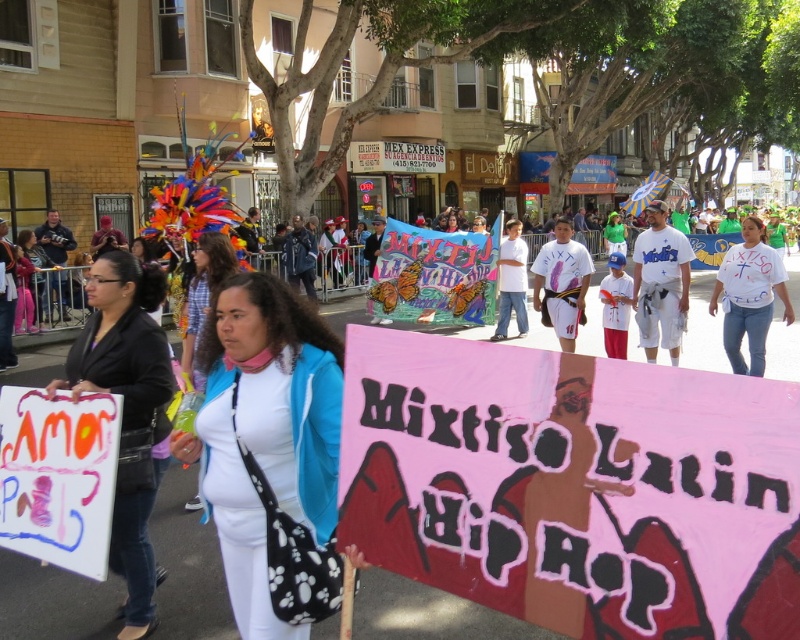
You are a photographer standing in the middle of the street during a festival. You want to take a photo that includes both the pink paper sign at center and the white matte jacket at center. If your camera has a 12 inch focus range, will both objects fit within the focus range?

The distance between the pink paper sign at center and the white matte jacket at center is 23.83 inches. Since the camera has a 12 inch focus range, which is shorter than the distance between them, both objects cannot fit within the focus range.

You are standing in the middle of the street looking at the two women in the scene. Which of the two points, point (728, 353) or point (192, 362), is closer to you?

Point (192, 362) is closer to you because it is less further to the camera than point (728, 353).